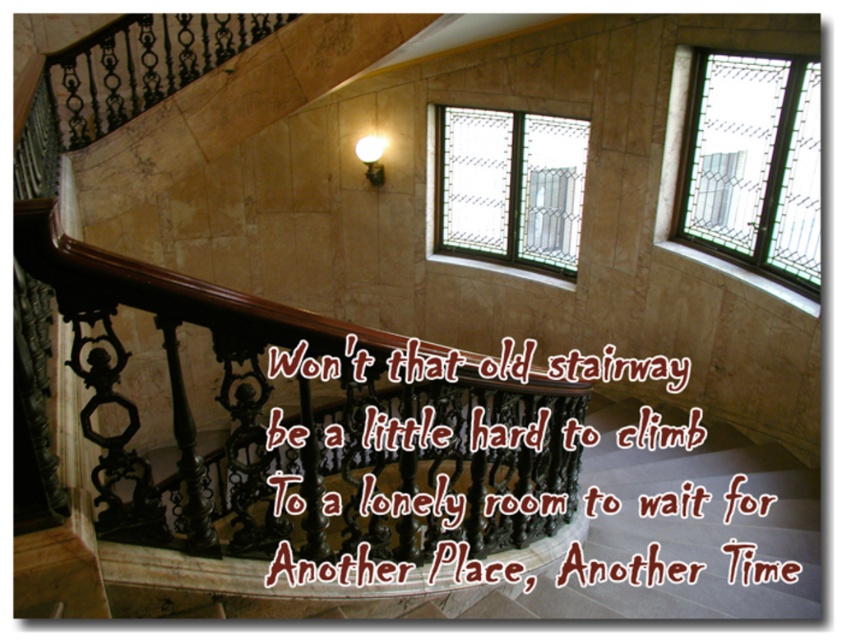
Question: Is polished marble stairs at center further to the viewer compared to clear glass window at upper right?

Choices:
 (A) yes
 (B) no

Answer: (B)

Question: Is the position of clear glass window at upper right more distant than that of clear glass window at center?

Choices:
 (A) yes
 (B) no

Answer: (B)

Question: Among these points, which one is farthest from the camera?

Choices:
 (A) (695, 173)
 (B) (196, 465)
 (C) (483, 150)

Answer: (C)

Question: Based on their relative distances, which object is farther from the clear glass window at center?

Choices:
 (A) brown polished wood at upper center
 (B) clear glass window at upper right

Answer: (A)

Question: Observing the image, what is the correct spatial positioning of brown polished wood at upper center in reference to clear glass window at center?

Choices:
 (A) below
 (B) above

Answer: (A)

Question: Which point is farther to the camera?

Choices:
 (A) (232, 609)
 (B) (509, 157)
 (C) (813, 269)
 (D) (483, 461)

Answer: (B)